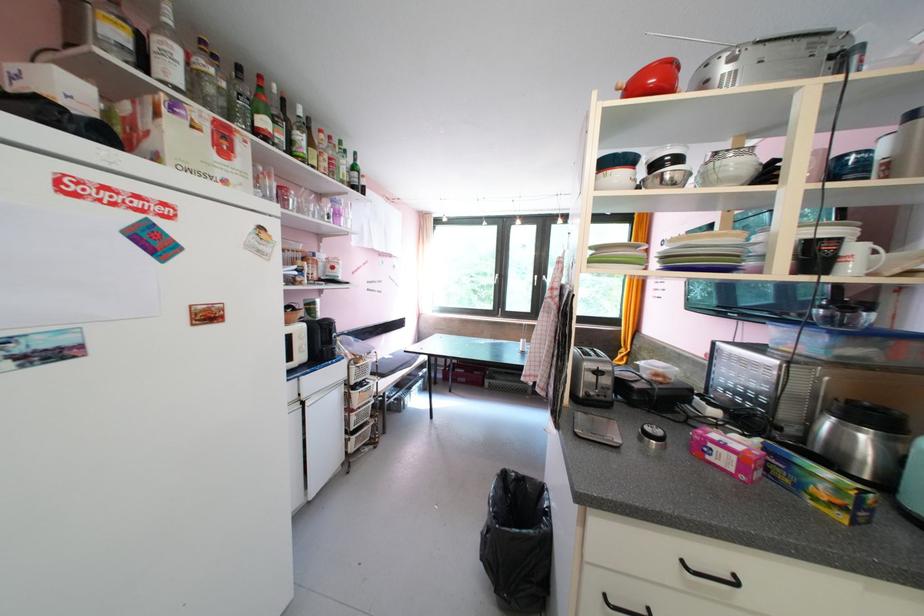
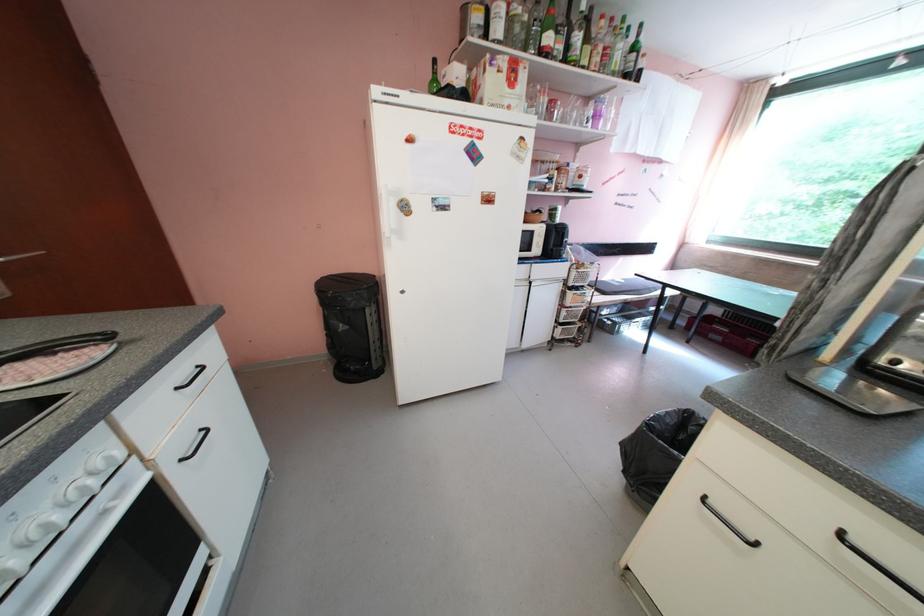
The point at (270, 169) is marked in the first image. Where is the corresponding point in the second image?

(546, 90)